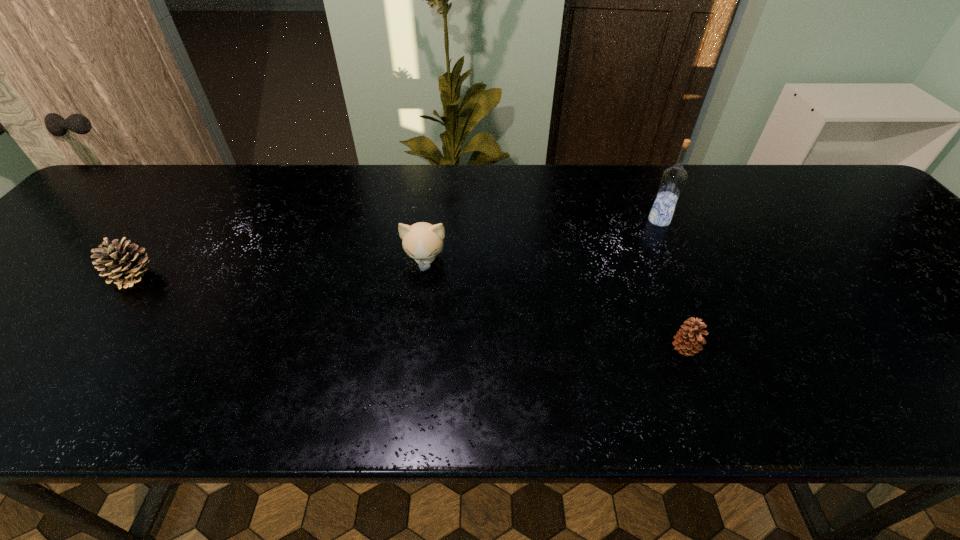
Find the location of a particular element. Image resolution: width=960 pixels, height=540 pixels. free space that satisfies the following two spatial constraints: 1. on the back side of the farthest object; 2. on the left side of the taller pinecone is located at coordinates (176, 220).

The width and height of the screenshot is (960, 540). Find the location of `free point that satisfies the following two spatial constraints: 1. on the face of the nearest object; 2. on the right side of the kitten`. free point that satisfies the following two spatial constraints: 1. on the face of the nearest object; 2. on the right side of the kitten is located at coordinates (414, 349).